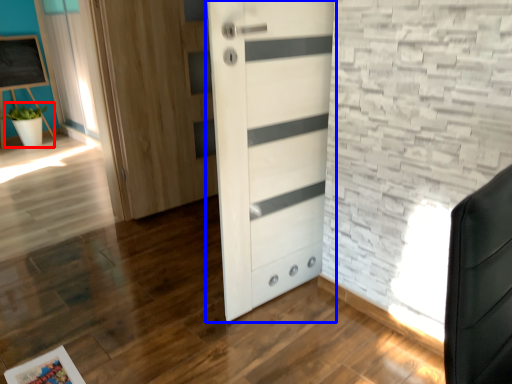
Question: Among these objects, which one is nearest to the camera, plant (highlighted by a red box) or door (highlighted by a blue box)?

Choices:
 (A) plant
 (B) door

Answer: (B)